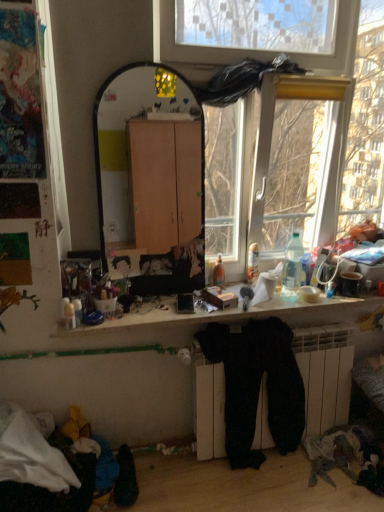
Question: From a real-world perspective, is clear plastic bottle at right physically below silky black fabric at center, the 2th person in the left-to-right sequence?

Choices:
 (A) yes
 (B) no

Answer: (B)

Question: Does clear plastic bottle at right turn towards silky black fabric at center, which is the first person in right-to-left order?

Choices:
 (A) yes
 (B) no

Answer: (B)

Question: From a real-world perspective, is clear plastic bottle at right over silky black fabric at center, which is the first person in right-to-left order?

Choices:
 (A) yes
 (B) no

Answer: (A)

Question: Considering the relative sizes of clear plastic bottle at right and silky black fabric at center, which is the first person in right-to-left order, in the image provided, is clear plastic bottle at right bigger than silky black fabric at center, which is the first person in right-to-left order,?

Choices:
 (A) yes
 (B) no

Answer: (A)

Question: Does clear plastic bottle at right lie in front of silky black fabric at center, the 2th person in the left-to-right sequence?

Choices:
 (A) yes
 (B) no

Answer: (A)

Question: Considering their positions, is black velvet pants at lower center located in front of or behind silky black fabric at center, the 2th person in the left-to-right sequence?

Choices:
 (A) behind
 (B) front

Answer: (B)

Question: In terms of height, does black velvet pants at lower center look taller or shorter compared to silky black fabric at center, which is the first person in right-to-left order?

Choices:
 (A) short
 (B) tall

Answer: (B)

Question: Would you say black velvet pants at lower center is to the left or to the right of silky black fabric at center, the 2th person in the left-to-right sequence, in the picture?

Choices:
 (A) right
 (B) left

Answer: (A)

Question: Looking at the image, does black velvet pants at lower center seem bigger or smaller compared to silky black fabric at center, which is the first person in right-to-left order?

Choices:
 (A) small
 (B) big

Answer: (B)

Question: Is black velvet pants at lower center to the left or to the right of wooden desk at center in the image?

Choices:
 (A) left
 (B) right

Answer: (B)

Question: From the image's perspective, relative to wooden desk at center, is black velvet pants at lower center above or below?

Choices:
 (A) above
 (B) below

Answer: (B)

Question: From a real-world perspective, is black velvet pants at lower center positioned above or below wooden desk at center?

Choices:
 (A) below
 (B) above

Answer: (A)

Question: Considering the positions of black velvet pants at lower center and wooden desk at center in the image, is black velvet pants at lower center taller or shorter than wooden desk at center?

Choices:
 (A) short
 (B) tall

Answer: (B)

Question: Is black velvet pants at lower center situated inside clear plastic bottle at right or outside?

Choices:
 (A) inside
 (B) outside

Answer: (B)

Question: From the image's perspective, is black velvet pants at lower center above or below clear plastic bottle at right?

Choices:
 (A) below
 (B) above

Answer: (A)